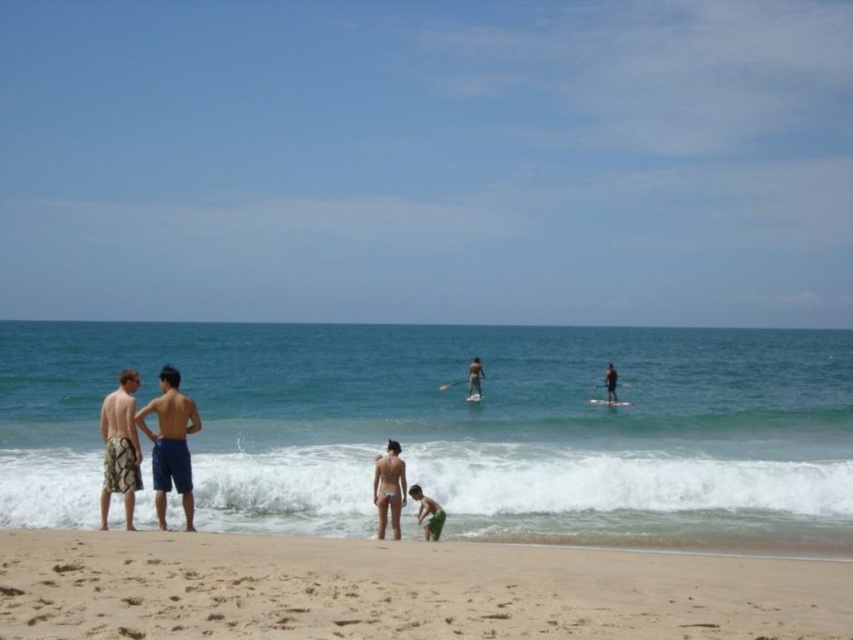
Can you confirm if clear blue water at center is bigger than smooth tan surfboard at center?

Yes.

Who is more distant from viewer, (770, 534) or (479, 388)?

Positioned behind is point (479, 388).

This screenshot has height=640, width=853. Find the location of `clear blue water at center`. clear blue water at center is located at coordinates (456, 428).

This screenshot has width=853, height=640. Find the location of `clear blue water at center`. clear blue water at center is located at coordinates (456, 428).

Is matte white bikini at center to the right of smooth tan surfboard at center from the viewer's perspective?

In fact, matte white bikini at center is to the left of smooth tan surfboard at center.

In the scene shown: Can you confirm if matte white bikini at center is positioned above smooth tan surfboard at center?

Yes, matte white bikini at center is above smooth tan surfboard at center.

Locate an element on the screen. matte white bikini at center is located at coordinates (389, 488).

Is sandy beach at lower center further to camera compared to green cotton shorts at lower center?

That is False.

Is point (624, 586) positioned after point (440, 506)?

That is False.

Locate an element on the screen. The width and height of the screenshot is (853, 640). sandy beach at lower center is located at coordinates (402, 589).